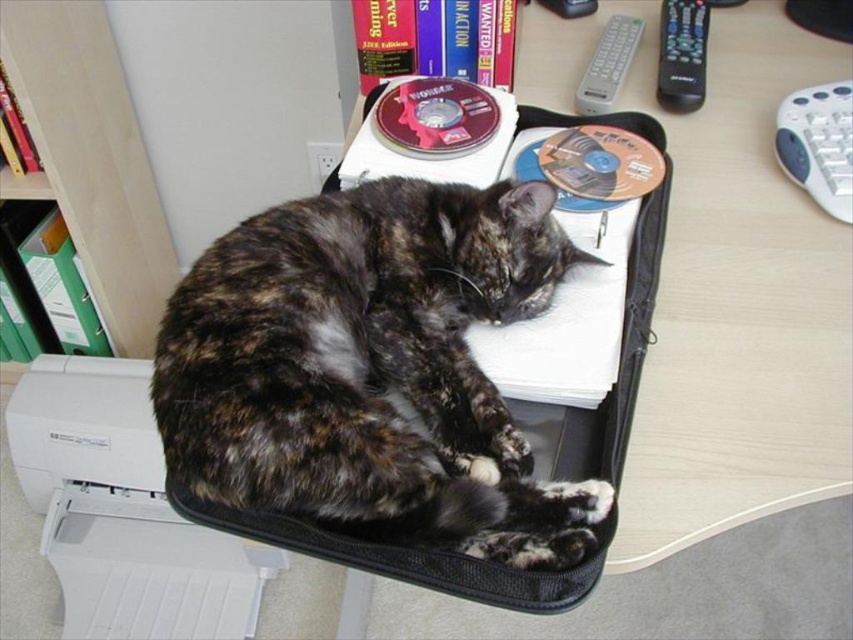
Question: Does black plastic remote at upper right appear on the left side of gray plastic remote at upper center?

Choices:
 (A) yes
 (B) no

Answer: (B)

Question: Estimate the real-world distances between objects in this image. Which object is closer to the green plastic file at upper left?

Choices:
 (A) tortoiseshell fur cat at center
 (B) shiny silver cd at center
 (C) black plastic remote at upper right
 (D) gray plastic remote at upper center

Answer: (B)

Question: Which of these objects is positioned closest to the green plastic file at upper left?

Choices:
 (A) black plastic remote at upper right
 (B) gray plastic remote at upper center
 (C) tortoiseshell fur cat at center
 (D) shiny silver cd at center

Answer: (D)

Question: Is green plastic file at upper left above shiny silver cd at center?

Choices:
 (A) no
 (B) yes

Answer: (B)

Question: Which object appears farthest from the camera in this image?

Choices:
 (A) gray plastic remote at upper center
 (B) tortoiseshell fur cat at center
 (C) shiny silver cd at center
 (D) black plastic remote at upper right

Answer: (A)

Question: Can you confirm if tortoiseshell fur cat at center is thinner than green plastic file at upper left?

Choices:
 (A) yes
 (B) no

Answer: (B)